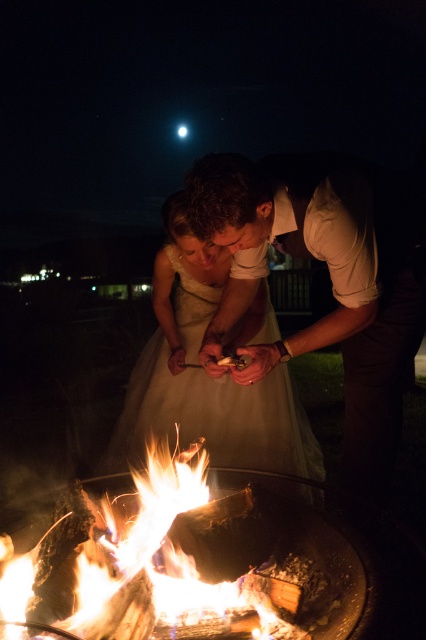
Question: Which point appears closest to the camera in this image?

Choices:
 (A) (118, 529)
 (B) (226, 385)

Answer: (A)

Question: Among these points, which one is nearest to the camera?

Choices:
 (A) (247, 368)
 (B) (138, 420)

Answer: (A)

Question: Is smooth beige shirt at center wider than white satin dress at center?

Choices:
 (A) yes
 (B) no

Answer: (B)

Question: Can you confirm if smooth beige shirt at center is positioned below flaming wood at center?

Choices:
 (A) yes
 (B) no

Answer: (B)

Question: Which object is closer to the camera taking this photo?

Choices:
 (A) white satin dress at center
 (B) smooth beige shirt at center
 (C) flaming wood at center

Answer: (C)

Question: Does smooth beige shirt at center appear over flaming wood at center?

Choices:
 (A) yes
 (B) no

Answer: (A)